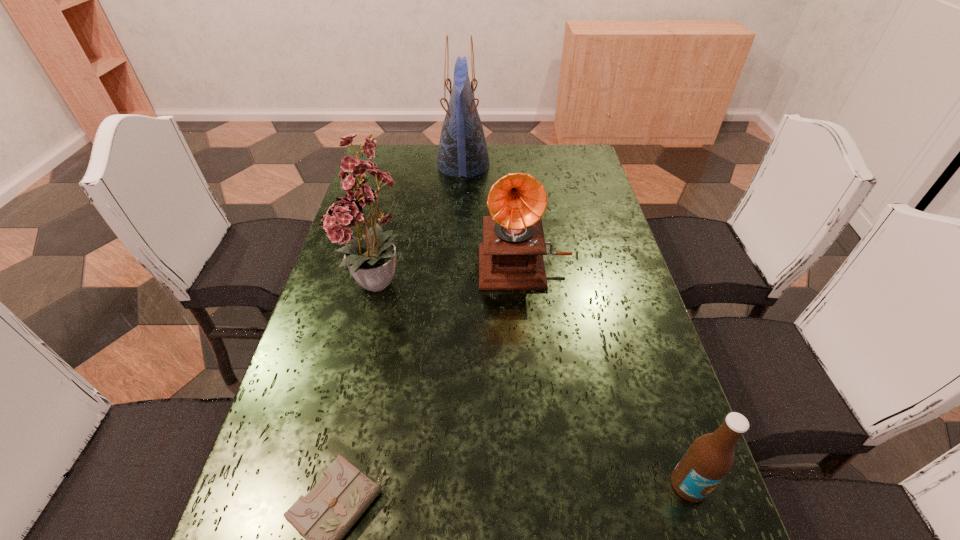
Image resolution: width=960 pixels, height=540 pixels. I want to click on object positioned at the left edge, so click(372, 260).

The width and height of the screenshot is (960, 540). Identify the location of object that is at the right edge. (710, 457).

You are a GUI agent. You are given a task and a screenshot of the screen. Output one action in this format:
    pyautogui.click(x=<x>, y=<y>)
    Task: Click on the vacant space at the far edge of the desktop
    The width and height of the screenshot is (960, 540).
    Given the screenshot: What is the action you would take?
    pyautogui.click(x=421, y=171)

Identify the location of vacant space at the left edge of the desktop. This screenshot has width=960, height=540. (391, 198).

In order to click on free space at the right edge of the desktop in this screenshot , I will do point(567,210).

This screenshot has height=540, width=960. In the image, there is a desktop. In order to click on vacant space at the far left corner in this screenshot , I will do `click(408, 168)`.

Locate an element on the screen. free spot at the far right corner of the desktop is located at coordinates (560, 157).

I want to click on vacant region between the rightmost object and the flower arrangement, so click(x=534, y=386).

This screenshot has height=540, width=960. What are the coordinates of `free space between the second shortest object and the phonograph record` in the screenshot? It's located at click(607, 374).

I want to click on unoccupied area between the flower arrangement and the shopping bag, so click(421, 225).